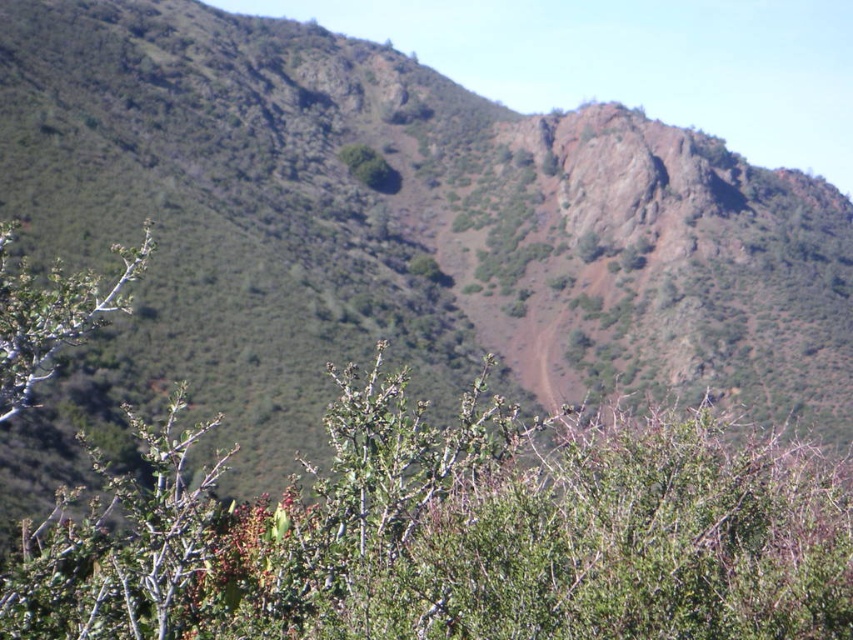
Question: Can you confirm if green leafy bush at center is positioned to the right of green leafy shrub at left?

Choices:
 (A) yes
 (B) no

Answer: (A)

Question: Among these objects, which one is farthest from the camera?

Choices:
 (A) green leafy bush at center
 (B) green leafy shrub at left

Answer: (B)

Question: Which point is closer to the camera taking this photo?

Choices:
 (A) (589, 512)
 (B) (149, 234)

Answer: (A)

Question: Which of the following is the closest to the observer?

Choices:
 (A) (4, 308)
 (B) (244, 522)

Answer: (A)

Question: Where is green leafy bush at center located in relation to green leafy shrub at left in the image?

Choices:
 (A) below
 (B) above

Answer: (A)

Question: Is green leafy bush at center to the left of green leafy shrub at left from the viewer's perspective?

Choices:
 (A) no
 (B) yes

Answer: (A)